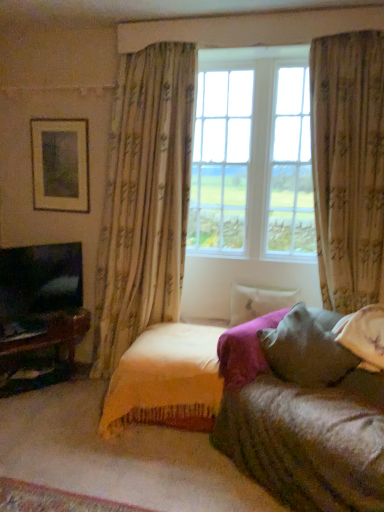
You are a GUI agent. You are given a task and a screenshot of the screen. Output one action in this format:
    pyautogui.click(x=<x>, y=<y>)
    Task: Click on the velvety gray pillow at lower right, which appears as the second pillow when viewed from the back
    This screenshot has height=512, width=384.
    Given the screenshot: What is the action you would take?
    pyautogui.click(x=307, y=348)

Find the location of a particular element. floral fabric curtain at center, the second curtain positioned from the right is located at coordinates (144, 199).

Measure the distance between point (111, 431) and camera.

Point (111, 431) and camera are 8.57 feet apart from each other.

This screenshot has height=512, width=384. What do you see at coordinates (60, 164) in the screenshot?
I see `matte gold picture frame at upper left` at bounding box center [60, 164].

Where is `white soft pillow at center, the 2th pillow from the front`? The height and width of the screenshot is (512, 384). white soft pillow at center, the 2th pillow from the front is located at coordinates (257, 302).

Find the location of a particular element. The image size is (384, 512). matte black tv at left is located at coordinates (40, 279).

Who is bigger, velvet yellow blanket at center or white glass window at center?

Bigger between the two is white glass window at center.

Consider the image. Is velvet yellow blanket at center in front of or behind white glass window at center in the image?

velvet yellow blanket at center is in front of white glass window at center.

From the image's perspective, is velvet yellow blanket at center above or below white glass window at center?

From the image's perspective, velvet yellow blanket at center appears below white glass window at center.

Does point (143, 336) lie in front of point (277, 72)?

Yes, point (143, 336) is closer to viewer.

Which of these two, white glass window at center or white soft pillow at center, the 2th pillow from the front, stands shorter?

With less height is white soft pillow at center, the 2th pillow from the front.

Is white glass window at center not within white soft pillow at center, the 2th pillow from the front?

Yes.

Is the depth of white glass window at center less than that of white soft pillow at center, the 2th pillow from the front?

Yes, white glass window at center is in front of white soft pillow at center, the 2th pillow from the front.

Are white glass window at center and white soft pillow at center, the 2th pillow from the front, far apart?

white glass window at center is actually quite close to white soft pillow at center, the 2th pillow from the front.

Which is nearer, (217,121) or (32,247)?

Point (217,121) is positioned farther from the camera compared to point (32,247).

Does white glass window at center appear on the right side of matte black tv at left?

Correct, you'll find white glass window at center to the right of matte black tv at left.

Looking at this image, between white glass window at center and matte black tv at left, which one is positioned in front?

white glass window at center is in front.

Is white glass window at center spatially inside matte black tv at left, or outside of it?

white glass window at center lies outside matte black tv at left.

Considering the relative sizes of matte gold picture frame at upper left and velvet yellow blanket at center in the image provided, is matte gold picture frame at upper left wider than velvet yellow blanket at center?

No.

Can you confirm if matte gold picture frame at upper left is shorter than velvet yellow blanket at center?

No, matte gold picture frame at upper left is not shorter than velvet yellow blanket at center.

Between matte gold picture frame at upper left and velvet yellow blanket at center, which one appears on the right side from the viewer's perspective?

velvet yellow blanket at center.

Considering the points (48, 157) and (214, 356), which point is in front, point (48, 157) or point (214, 356)?

The point (214, 356) is closer to the camera.

Considering the positions of objects matte black tv at left and velvety gray pillow at lower right, which appears as the second pillow when viewed from the back, in the image provided, who is in front, matte black tv at left or velvety gray pillow at lower right, which appears as the second pillow when viewed from the back,?

velvety gray pillow at lower right, which appears as the second pillow when viewed from the back, is in front.

What's the angular difference between matte black tv at left and velvety gray pillow at lower right, which ranks as the 1th pillow in front-to-back order,'s facing directions?

There is a 3.52-degree angle between the facing directions of matte black tv at left and velvety gray pillow at lower right, which ranks as the 1th pillow in front-to-back order.

From the image's perspective, is matte black tv at left located above or below velvety gray pillow at lower right, which appears as the second pillow when viewed from the back?

matte black tv at left is above velvety gray pillow at lower right, which appears as the second pillow when viewed from the back.

Can you confirm if matte black tv at left is positioned to the left of velvety gray pillow at lower right, which appears as the second pillow when viewed from the back?

Yes.

Starting from the floral fabric curtain at center, which is the first curtain from left to right, which pillow is the 2nd one to the right? Please provide its 2D coordinates.

[(307, 348)]

Does point (117, 298) come closer to viewer compared to point (303, 378)?

No, (117, 298) is further to viewer.

Is floral fabric curtain at center, the second curtain positioned from the right, completely or partially outside of velvety gray pillow at lower right, which ranks as the 1th pillow in front-to-back order?

floral fabric curtain at center, the second curtain positioned from the right, lies outside velvety gray pillow at lower right, which ranks as the 1th pillow in front-to-back order,'s area.

From the image's perspective, is floral fabric curtain at center, which is the first curtain from left to right, located above velvety gray pillow at lower right, which ranks as the 1th pillow in front-to-back order?

Indeed, from the image's perspective, floral fabric curtain at center, which is the first curtain from left to right, is shown above velvety gray pillow at lower right, which ranks as the 1th pillow in front-to-back order.

From a real-world perspective, relative to velvety gray pillow at lower right, which appears as the second pillow when viewed from the back, is velvet yellow blanket at center vertically above or below?

velvet yellow blanket at center is below velvety gray pillow at lower right, which appears as the second pillow when viewed from the back.

Is velvet yellow blanket at center further to camera compared to velvety gray pillow at lower right, which ranks as the 1th pillow in front-to-back order?

Yes, velvet yellow blanket at center is further from the camera.

Is velvet yellow blanket at center thinner than velvety gray pillow at lower right, which ranks as the 1th pillow in front-to-back order?

Incorrect, the width of velvet yellow blanket at center is not less than that of velvety gray pillow at lower right, which ranks as the 1th pillow in front-to-back order.

Find the location of a particular element. The height and width of the screenshot is (512, 384). bedding in front of the white glass window at center is located at coordinates (166, 380).

From a real-world perspective, which pillow is the 2nd one underneath the white glass window at center? Please provide its 2D coordinates.

[(257, 302)]

In the scene shown: From the image, which object appears to be nearer to textured beige curtain at right, acting as the 2th curtain starting from the left, white soft pillow at center, positioned as the first pillow in back-to-front order, or velvety gray pillow at lower right, which ranks as the 1th pillow in front-to-back order?

velvety gray pillow at lower right, which ranks as the 1th pillow in front-to-back order, is positioned closer to the anchor textured beige curtain at right, acting as the 2th curtain starting from the left.

Looking at the image, which one is located further to matte gold picture frame at upper left, white soft pillow at center, the 2th pillow from the front, or matte black tv at left?

white soft pillow at center, the 2th pillow from the front, is positioned further to the anchor matte gold picture frame at upper left.

Estimate the real-world distances between objects in this image. Which object is further from white soft pillow at center, positioned as the first pillow in back-to-front order, matte black tv at left or textured beige curtain at right, acting as the 2th curtain starting from the left?

Among the two, matte black tv at left is located further to white soft pillow at center, positioned as the first pillow in back-to-front order.

Considering their positions, is matte gold picture frame at upper left positioned closer to white soft pillow at center, positioned as the first pillow in back-to-front order, than matte black tv at left?

matte black tv at left is positioned closer to the anchor white soft pillow at center, positioned as the first pillow in back-to-front order.

Looking at the image, which one is located closer to matte gold picture frame at upper left, matte black tv at left or white soft pillow at center, the 2th pillow from the front?

matte black tv at left lies closer to matte gold picture frame at upper left than the other object.

When comparing their distances from matte black tv at left, does matte gold picture frame at upper left or white glass window at center seem further?

white glass window at center.

Estimate the real-world distances between objects in this image. Which object is further from floral fabric curtain at center, which is the first curtain from left to right, white glass window at center or textured beige curtain at right, acting as the first curtain starting from the right?

textured beige curtain at right, acting as the first curtain starting from the right, is further to floral fabric curtain at center, which is the first curtain from left to right.

When comparing their distances from white soft pillow at center, the 2th pillow from the front, does white glass window at center or textured beige curtain at right, acting as the first curtain starting from the right, seem further?

Based on the image, textured beige curtain at right, acting as the first curtain starting from the right, appears to be further to white soft pillow at center, the 2th pillow from the front.

The width and height of the screenshot is (384, 512). I want to click on bedding located between matte black tv at left and white soft pillow at center, the 2th pillow from the front, in the left-right direction, so click(166, 380).

The height and width of the screenshot is (512, 384). I want to click on window between matte black tv at left and velvety gray pillow at lower right, which ranks as the 1th pillow in front-to-back order, from left to right, so click(x=252, y=156).

The height and width of the screenshot is (512, 384). I want to click on television between matte gold picture frame at upper left and velvet yellow blanket at center from top to bottom, so click(40, 279).

You are a GUI agent. You are given a task and a screenshot of the screen. Output one action in this format:
    pyautogui.click(x=<x>, y=<y>)
    Task: Click on the window between floral fabric curtain at center, the second curtain positioned from the right, and textured beige curtain at right, acting as the 2th curtain starting from the left, from left to right
    
    Given the screenshot: What is the action you would take?
    pyautogui.click(x=252, y=156)